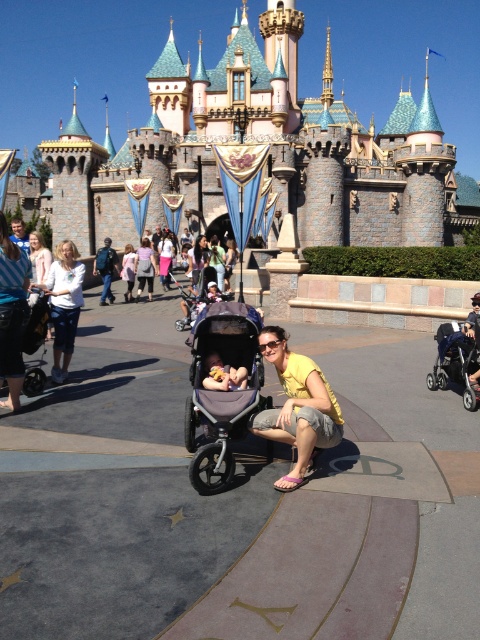
Does matte white shirt at center have a greater height compared to white cotton shirt at center?

In fact, matte white shirt at center may be shorter than white cotton shirt at center.

Is matte white shirt at center smaller than white cotton shirt at center?

Yes.

Does point (14, 284) lie in front of point (57, 276)?

Yes, point (14, 284) is closer to viewer.

Where is `matte white shirt at center`? matte white shirt at center is located at coordinates (12, 314).

Can you confirm if gray fabric stroller at center is positioned to the right of matte white shirt at center?

Correct, you'll find gray fabric stroller at center to the right of matte white shirt at center.

Is gray fabric stroller at center bigger than matte white shirt at center?

Indeed, gray fabric stroller at center has a larger size compared to matte white shirt at center.

Measure the distance between gray fabric stroller at center and camera.

The distance of gray fabric stroller at center from camera is 43.84 meters.

You are a GUI agent. You are given a task and a screenshot of the screen. Output one action in this format:
    pyautogui.click(x=<x>, y=<y>)
    Task: Click on the gray fabric stroller at center
    This screenshot has width=480, height=640.
    Given the screenshot: What is the action you would take?
    pyautogui.click(x=222, y=390)

Can you confirm if gray fabric stroller at center is positioned to the right of matte pink shirt at center?

Yes, gray fabric stroller at center is to the right of matte pink shirt at center.

Image resolution: width=480 pixels, height=640 pixels. Describe the element at coordinates (222, 390) in the screenshot. I see `gray fabric stroller at center` at that location.

I want to click on gray fabric stroller at center, so click(222, 390).